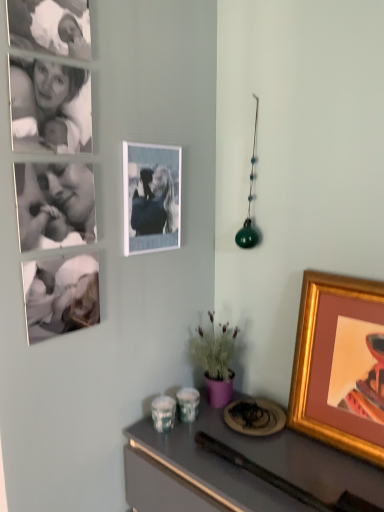
Question: Is matte white photo frame at upper center, which is the 2th picture frame in right-to-left order, situated inside metallic gray desk at lower right or outside?

Choices:
 (A) outside
 (B) inside

Answer: (A)

Question: From a real-world perspective, is matte white photo frame at upper center, which is the 2th picture frame in right-to-left order, physically located above or below metallic gray desk at lower right?

Choices:
 (A) above
 (B) below

Answer: (A)

Question: Which of these objects is positioned farthest from the matte white photo frame at upper center, which appears as the 1th picture frame when viewed from the left?

Choices:
 (A) metallic gray desk at lower right
 (B) black and white photograph of a person at upper left
 (C) gold-framed picture at right, which ranks as the second picture frame in top-to-bottom order

Answer: (A)

Question: Estimate the real-world distances between objects in this image. Which object is farther from the matte white photo frame at upper center, the first picture frame in the top-to-bottom sequence?

Choices:
 (A) metallic gray desk at lower right
 (B) black and white photograph of a person at upper left
 (C) gold-framed picture at right, which ranks as the second picture frame in top-to-bottom order

Answer: (A)